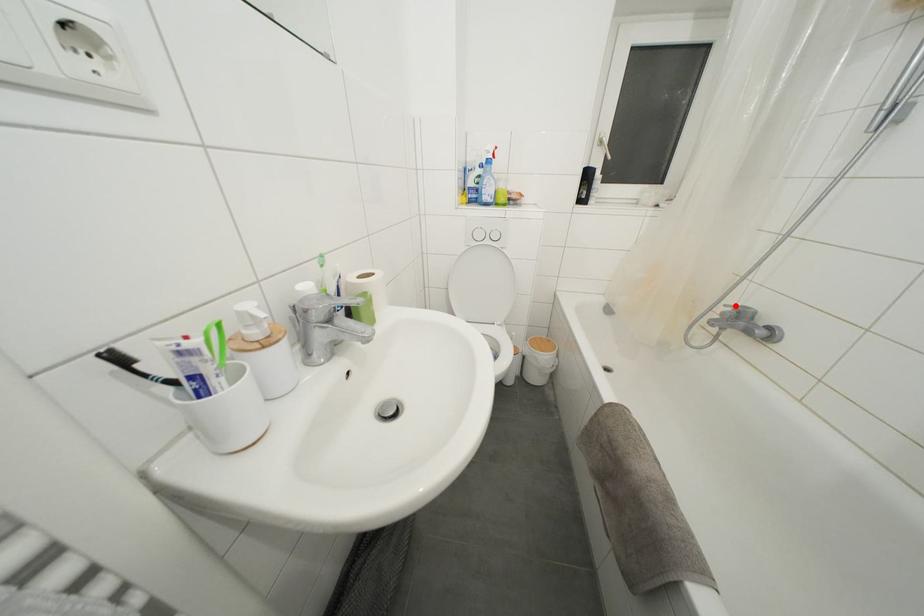
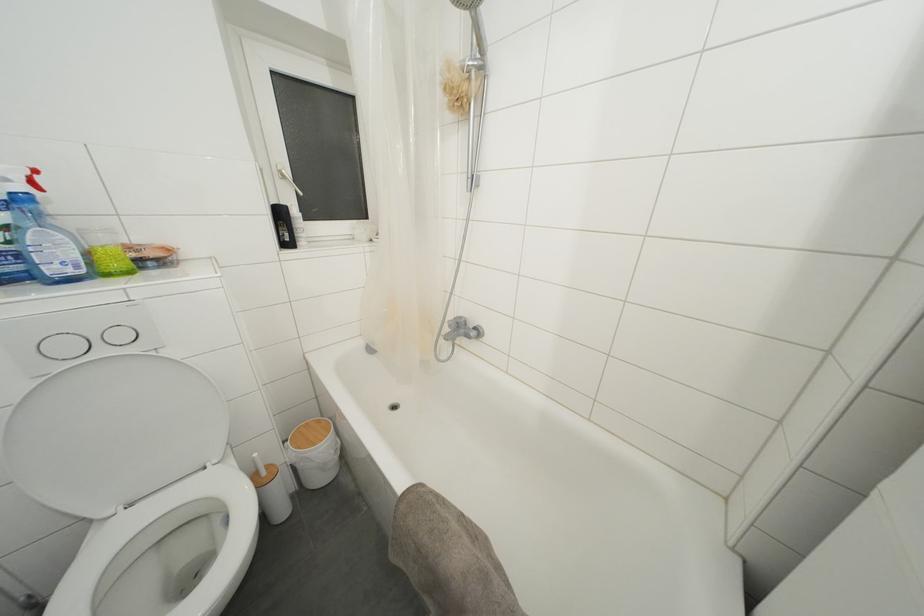
The point at the highlighted location is marked in the first image. Where is the corresponding point in the second image?

(455, 321)